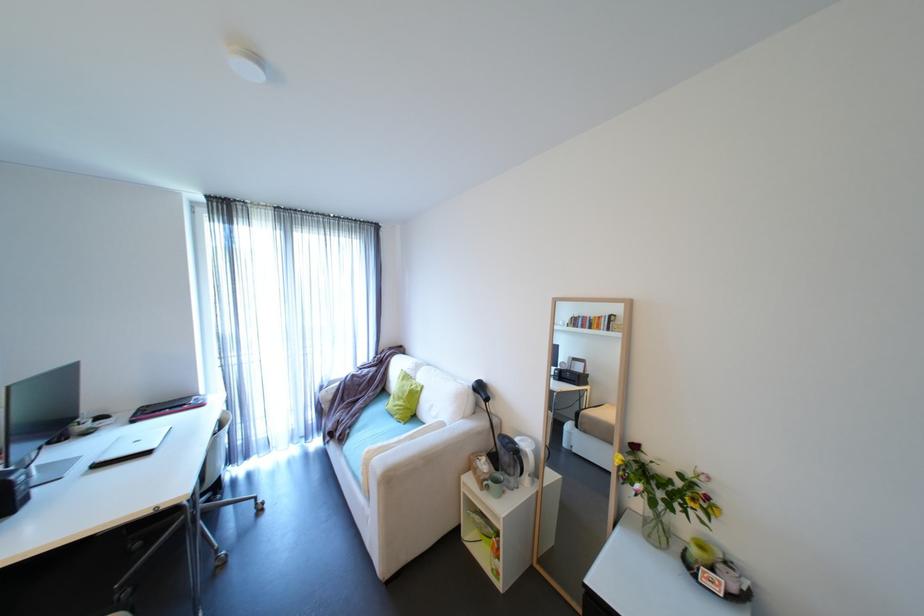
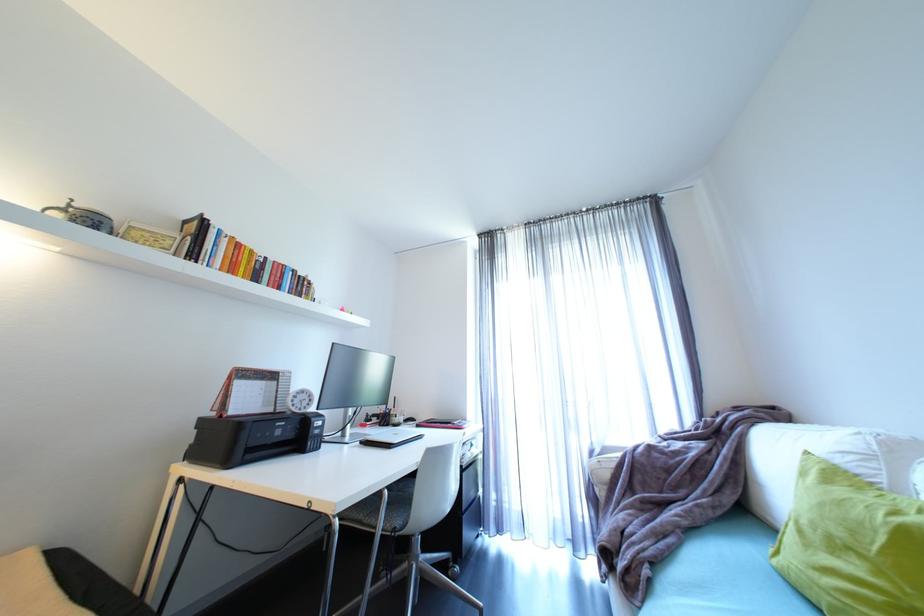
Locate, in the second image, the point that corresponds to pixel 192 503 in the first image.

(344, 522)